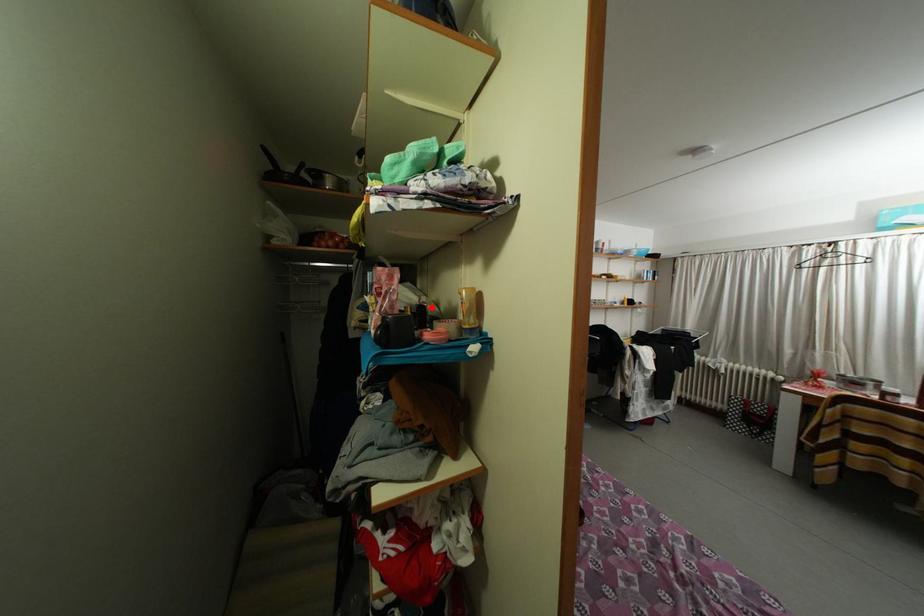
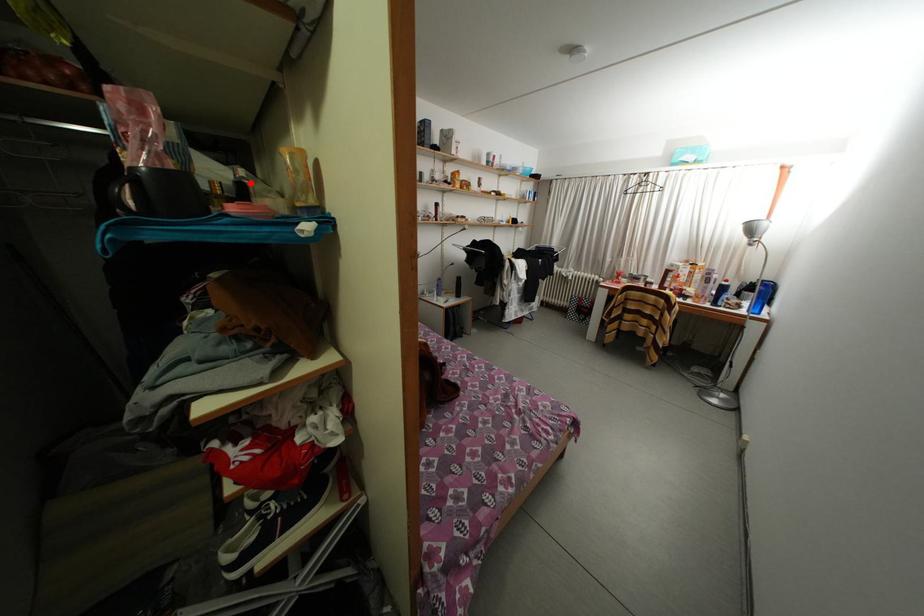
I am providing you with two images of the same scene from different viewpoints. A red point is marked on the first image and another point is marked on the second image. Do the highlighted points in image1 and image2 indicate the same real-world spot?

Yes